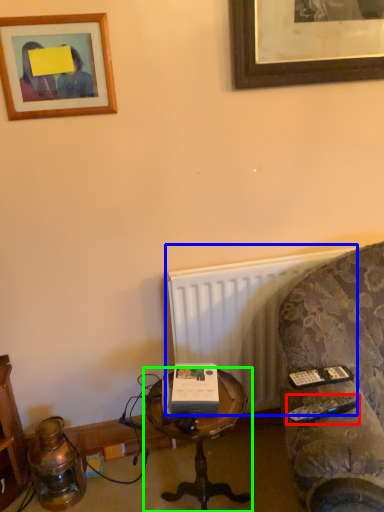
Question: Which is nearer to the remote (highlighted by a red box)? radiator (highlighted by a blue box) or table (highlighted by a green box).

Choices:
 (A) radiator
 (B) table

Answer: (B)